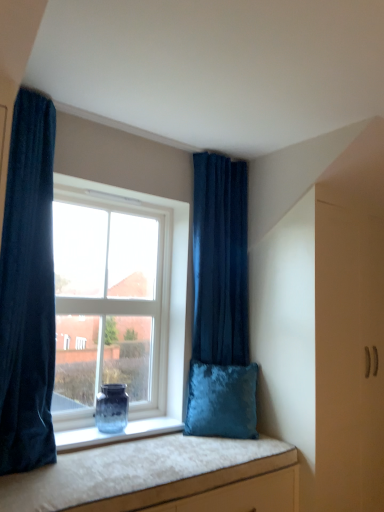
The height and width of the screenshot is (512, 384). Find the location of `unoccupied region to the right of velvet dark blue curtain at left, the 2th curtain when ordered from back to front`. unoccupied region to the right of velvet dark blue curtain at left, the 2th curtain when ordered from back to front is located at coordinates (99, 469).